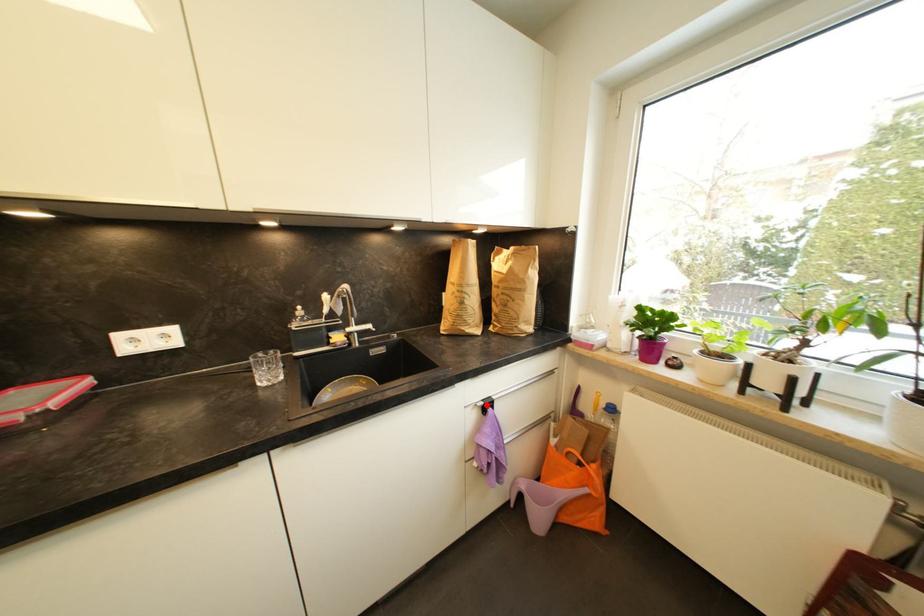
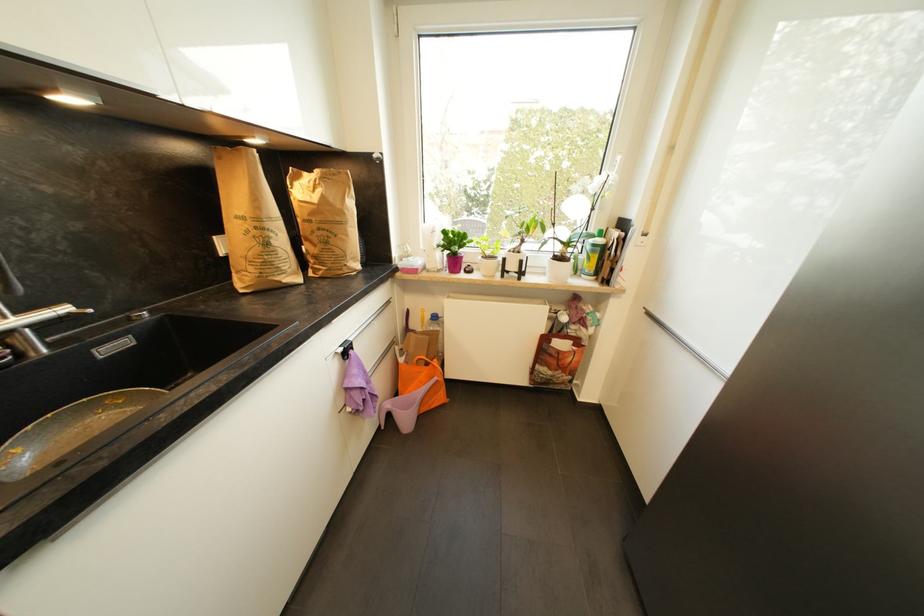
In the second image, find the point that corresponds to the highlighted location in the first image.

(346, 351)